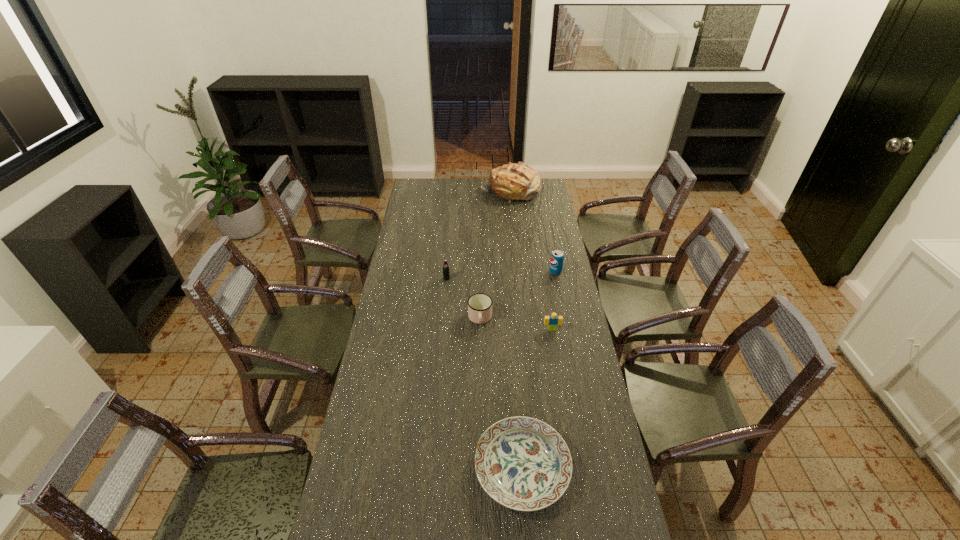
You are a GUI agent. You are given a task and a screenshot of the screen. Output one action in this format:
    pyautogui.click(x=<x>, y=<y>)
    Task: Click on the plate located at the right edge
    The width and height of the screenshot is (960, 540).
    Given the screenshot: What is the action you would take?
    pyautogui.click(x=522, y=463)

You are a GUI agent. You are given a task and a screenshot of the screen. Output one action in this format:
    pyautogui.click(x=<x>, y=<y>)
    Task: Click on the object present at the far right corner
    The height and width of the screenshot is (540, 960).
    Given the screenshot: What is the action you would take?
    pyautogui.click(x=519, y=181)

The width and height of the screenshot is (960, 540). I want to click on free space at the left edge of the desktop, so click(x=396, y=396).

The width and height of the screenshot is (960, 540). I want to click on vacant space at the right edge, so click(543, 224).

The width and height of the screenshot is (960, 540). What are the coordinates of `vacant space at the far left corner of the desktop` in the screenshot? It's located at (424, 189).

You are a GUI agent. You are given a task and a screenshot of the screen. Output one action in this format:
    pyautogui.click(x=<x>, y=<y>)
    Task: Click on the empty space between the nearer pop and the nearest object
    This screenshot has height=540, width=960.
    Given the screenshot: What is the action you would take?
    pyautogui.click(x=485, y=373)

Find the location of `free space between the Lego and the farthest object`. free space between the Lego and the farthest object is located at coordinates (x=531, y=260).

Image resolution: width=960 pixels, height=540 pixels. What are the coordinates of `blank region between the mug and the leftmost object` in the screenshot? It's located at (464, 299).

Find the location of `vacant space that is in between the shortest object and the right pop`. vacant space that is in between the shortest object and the right pop is located at coordinates (539, 370).

The height and width of the screenshot is (540, 960). In order to click on free space between the tallest object and the Lego in this screenshot , I will do `click(531, 260)`.